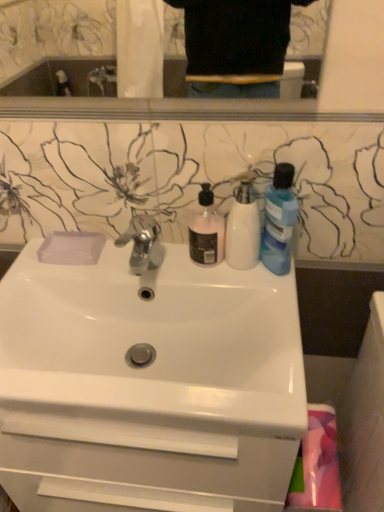
In order to click on free space in front of white matte bottle at center, marked as the 2th cleaning product in a left-to-right arrangement in this screenshot , I will do `click(262, 302)`.